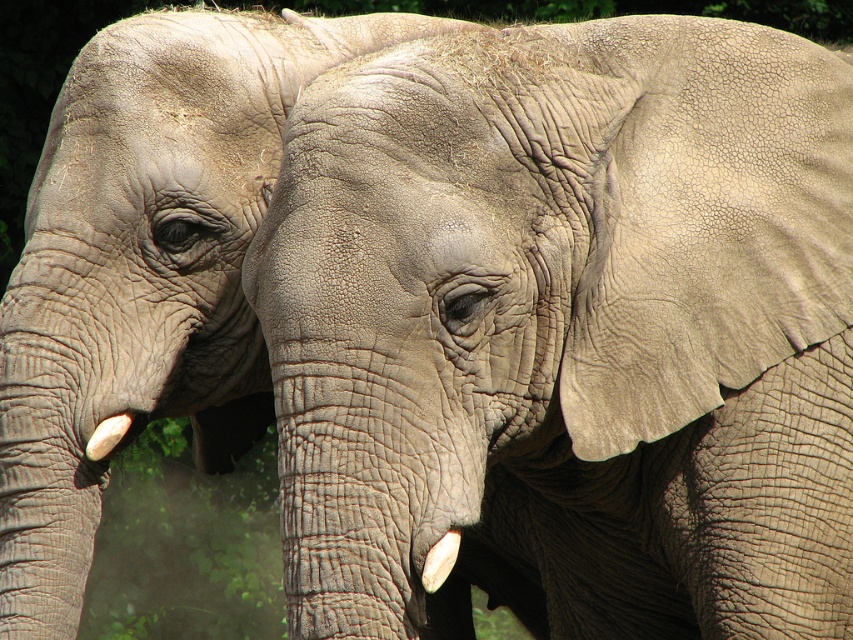
You are a wildlife photographer trying to capture a closeup shot of the white matte tusk at lower center without including the gray textured elephant at center in the frame. Based on their positions, is this possible?

The gray textured elephant at center is to the right of the white matte tusk at lower center, so if you position yourself to the left side of the white matte tusk at lower center and frame carefully, you can exclude the gray textured elephant at center from the shot.

You are a wildlife photographer aiming to capture a closeup of the gray textured elephant at center and the white ivory tusk at lower left. Given that your camera can only focus on objects within a 3 meter width, can you fit both subjects into the frame?

The gray textured elephant at center is wider than the white ivory tusk at lower left. Since the camera can focus on objects within a 3 meter width, you can fit both subjects into the frame as long as their combined width does not exceed 3 meters. However, the exact feasibility depends on the actual widths of each object, which are not provided here.

You are a wildlife photographer aiming to capture a closeup of both the white matte tusk at lower center and the white ivory tusk at lower left in your camera frame. Given that your camera has a maximum focus range of 30 inches, will you be able to include both tusks in the same shot?

The white matte tusk at lower center is 33.42 inches from the white ivory tusk at lower left. Since the distance exceeds the camera maximum focus range of 30 inches, you cannot include both tusks in the same shot.